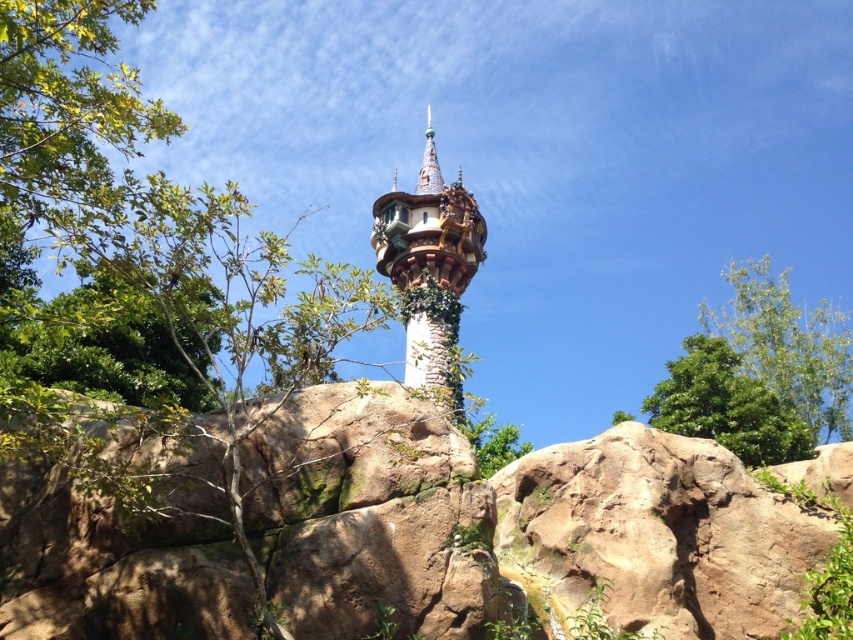
Based on the photo, can you confirm if brown rough rock at center is bigger than white stone tower at center?

No, brown rough rock at center is not bigger than white stone tower at center.

Does brown rough rock at center have a lesser height compared to white stone tower at center?

Yes, brown rough rock at center is shorter than white stone tower at center.

Between point (289, 628) and point (474, 211), which one is positioned behind?

Point (474, 211)

This screenshot has width=853, height=640. In order to click on brown rough rock at center in this screenshot , I will do `click(369, 515)`.

Is brown rough rock at lower right closer to the viewer compared to white stone tower at center?

Yes, brown rough rock at lower right is in front of white stone tower at center.

Is brown rough rock at lower right taller than white stone tower at center?

No, brown rough rock at lower right is not taller than white stone tower at center.

Find the location of a particular element. The width and height of the screenshot is (853, 640). brown rough rock at lower right is located at coordinates (656, 536).

Is brown rough rock at lower right bigger than green leafy tree at upper right?

No.

Is brown rough rock at lower right thinner than green leafy tree at upper right?

In fact, brown rough rock at lower right might be wider than green leafy tree at upper right.

Is point (544, 456) behind point (738, 452)?

No.

The image size is (853, 640). I want to click on brown rough rock at lower right, so click(x=656, y=536).